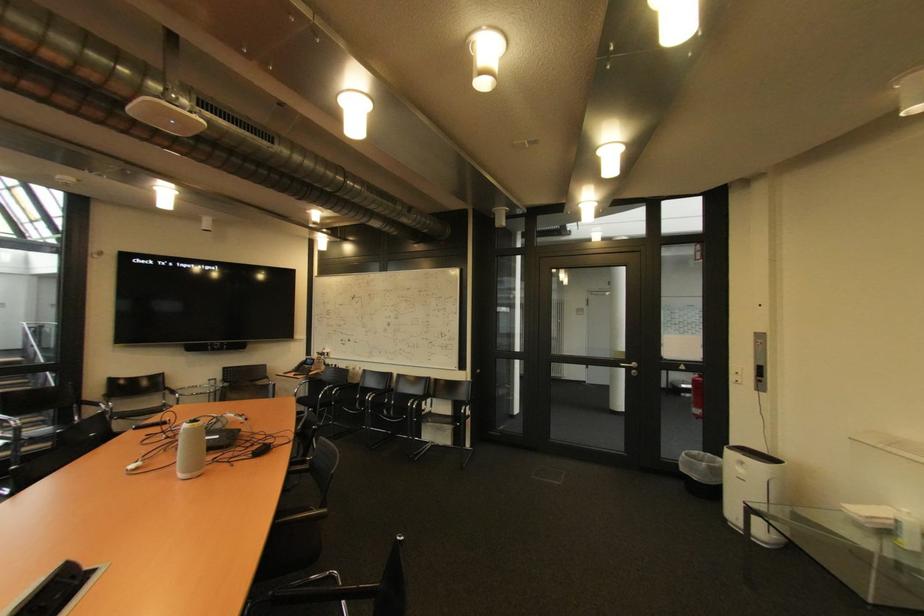
The image size is (924, 616). What do you see at coordinates (300, 514) in the screenshot?
I see `a black chair armrest` at bounding box center [300, 514].